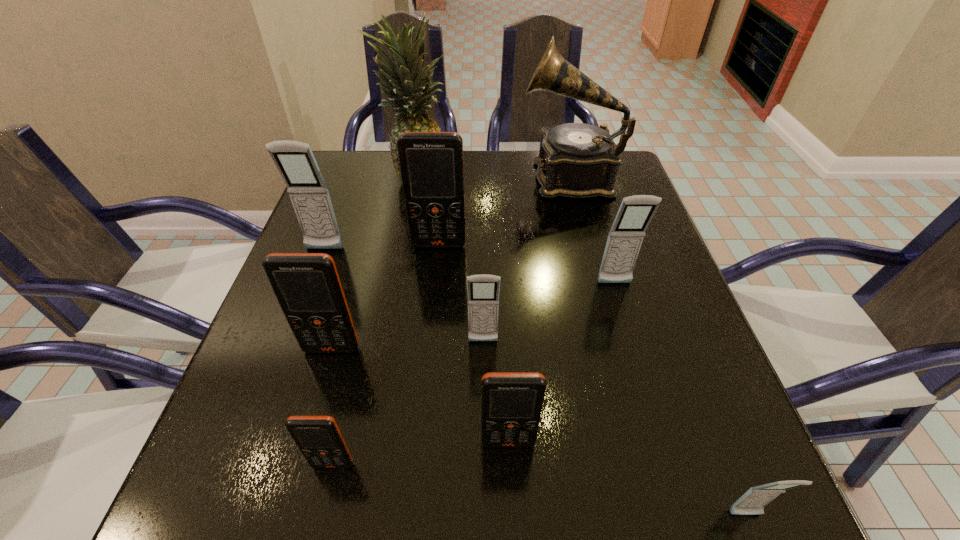
You are a GUI agent. You are given a task and a screenshot of the screen. Output one action in this format:
    pyautogui.click(x=<x>, y=<y>)
    Task: Click on the object that is at the far left corner
    
    Given the screenshot: What is the action you would take?
    pyautogui.click(x=409, y=88)

Identify the location of object that is at the near left corner. The height and width of the screenshot is (540, 960). (319, 439).

Locate an element on the screen. object present at the far right corner is located at coordinates (576, 160).

Find the location of a particular element. The width and height of the screenshot is (960, 540). object positioned at the near right corner is located at coordinates (753, 502).

In the image, there is a desktop. At what (x,y) coordinates should I click in order to perform the action: click on free space at the near edge. Please return your answer as a coordinate pair (x, y). Image resolution: width=960 pixels, height=540 pixels. Looking at the image, I should click on (606, 498).

You are a GUI agent. You are given a task and a screenshot of the screen. Output one action in this format:
    pyautogui.click(x=<x>, y=<y>)
    Task: Click on the free space at the left edge of the desktop
    
    Given the screenshot: What is the action you would take?
    pyautogui.click(x=374, y=210)

The width and height of the screenshot is (960, 540). What are the coordinates of `free space at the right edge of the desktop` in the screenshot? It's located at (624, 291).

Where is `vacant space at the far left corner`? vacant space at the far left corner is located at coordinates (355, 193).

Locate an element on the screen. This screenshot has height=540, width=960. vacant space at the near left corner of the desktop is located at coordinates (191, 515).

The image size is (960, 540). Identify the location of vacant space at the far right corner of the desktop. (625, 170).